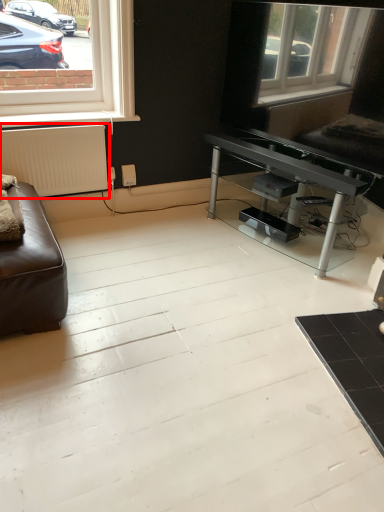
Question: Where is radiator (annotated by the red box) located in relation to table in the image?

Choices:
 (A) right
 (B) left

Answer: (B)